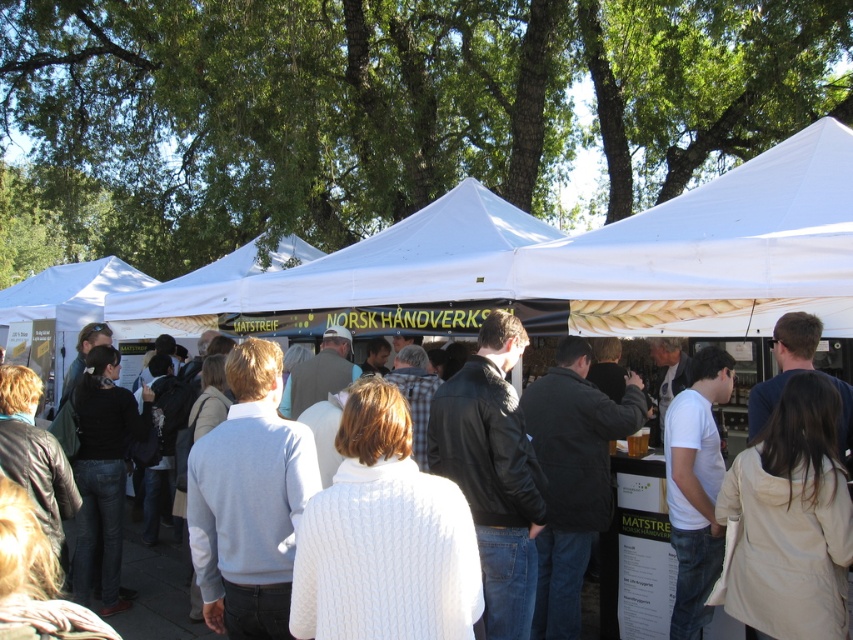
Is white fabric canopy at upper center positioned behind white sweater at center?

No, it is not.

Is point (830, 136) closer to camera compared to point (128, 547)?

Yes.

Identify the location of white fabric canopy at upper center. The width and height of the screenshot is (853, 640). (717, 252).